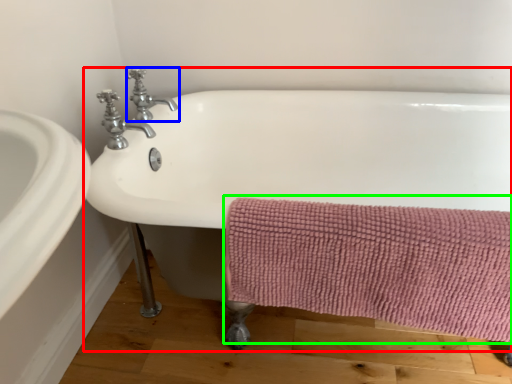
Question: Which object is positioned closest to bathtub (highlighted by a red box)? Select from tap (highlighted by a blue box) and bath towel (highlighted by a green box).

Choices:
 (A) tap
 (B) bath towel

Answer: (B)